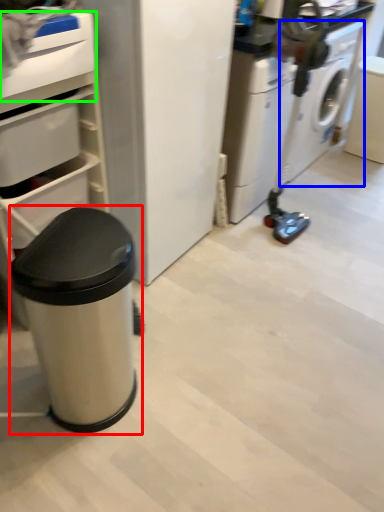
Question: Which object is the farthest from waste container (highlighted by a red box)? Choose among these: washing machine (highlighted by a blue box) or drawer (highlighted by a green box).

Choices:
 (A) washing machine
 (B) drawer

Answer: (A)